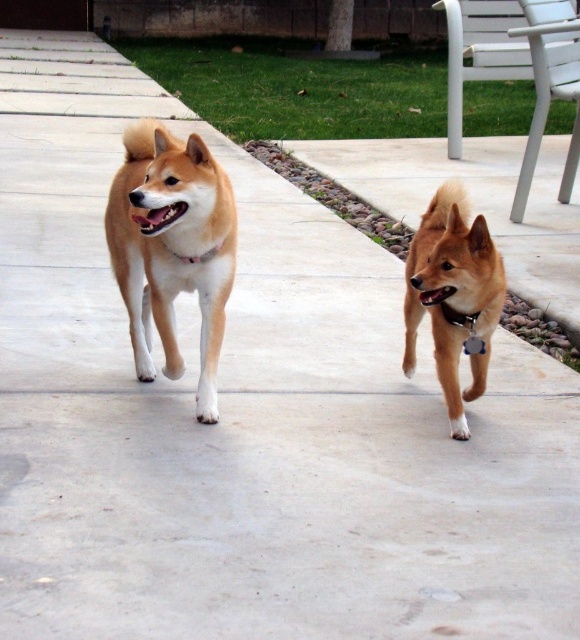
Can you confirm if golden fur dog at center is positioned above shiny brown fur at center?

Correct, golden fur dog at center is located above shiny brown fur at center.

Based on the photo, is golden fur dog at center smaller than shiny brown fur at center?

Actually, golden fur dog at center might be larger than shiny brown fur at center.

Which is behind, point (135, 138) or point (478, 301)?

Point (135, 138)

This screenshot has width=580, height=640. I want to click on golden fur dog at center, so click(172, 248).

Who is lower down, shiny brown fur at center or metallic silver tag at right?

metallic silver tag at right is lower down.

Is shiny brown fur at center behind metallic silver tag at right?

No.

Does point (447, 365) lie in front of point (462, 324)?

No, it is not.

At what (x,y) coordinates should I click in order to perform the action: click on shiny brown fur at center. Please return your answer as a coordinate pair (x, y). Looking at the image, I should click on pos(452,296).

Which is in front, point (200, 147) or point (476, 312)?

Point (200, 147) is more forward.

Identify the location of golden fur dog at center. (172, 248).